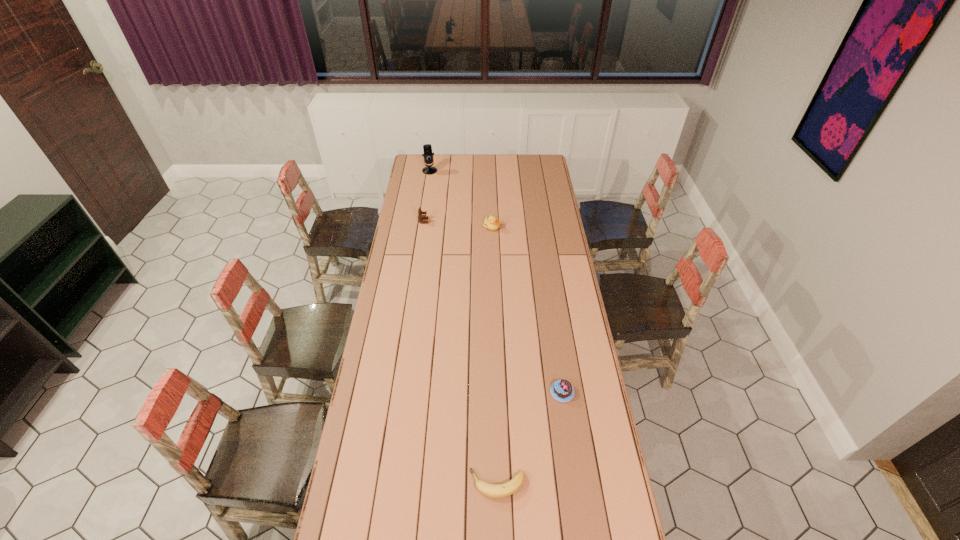
You are a GUI agent. You are given a task and a screenshot of the screen. Output one action in this format:
    pyautogui.click(x=<x>, y=<y>)
    Task: Click on the vacant space at the far edge
    
    Given the screenshot: What is the action you would take?
    pyautogui.click(x=523, y=173)

You are a GUI agent. You are given a task and a screenshot of the screen. Output one action in this format:
    pyautogui.click(x=<x>, y=<y>)
    Task: Click on the free space at the left edge of the desktop
    This screenshot has height=540, width=960.
    Given the screenshot: What is the action you would take?
    pyautogui.click(x=400, y=217)

Locate an element on the screen. free region at the right edge of the desktop is located at coordinates (555, 332).

Locate an element on the screen. The height and width of the screenshot is (540, 960). free region at the far left corner of the desktop is located at coordinates (414, 157).

Identify the location of free region at the far right corner of the desktop. The width and height of the screenshot is (960, 540). click(536, 174).

The width and height of the screenshot is (960, 540). Identify the location of free space between the banana and the chocolate cake. (530, 438).

I want to click on vacant region between the duckling and the teddy bear, so click(458, 224).

Identify the location of unoccupied area between the teddy bear and the rightmost object. The height and width of the screenshot is (540, 960). (492, 307).

Identify the location of vacant space in between the rightmost object and the nearest object. The height and width of the screenshot is (540, 960). (530, 438).

The width and height of the screenshot is (960, 540). What are the coordinates of `vacant area between the nearest object and the duckling` in the screenshot? It's located at (494, 355).